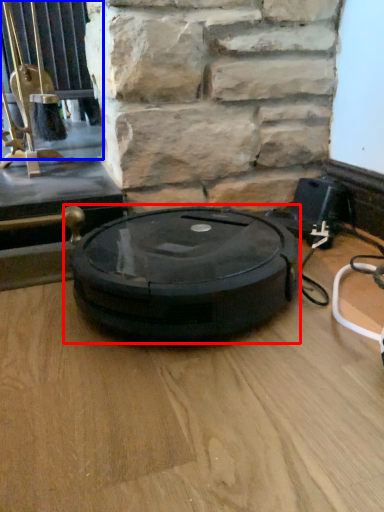
Question: Which of the following is the closest to the observer, weight scale (highlighted by a red box) or window (highlighted by a blue box)?

Choices:
 (A) weight scale
 (B) window

Answer: (A)